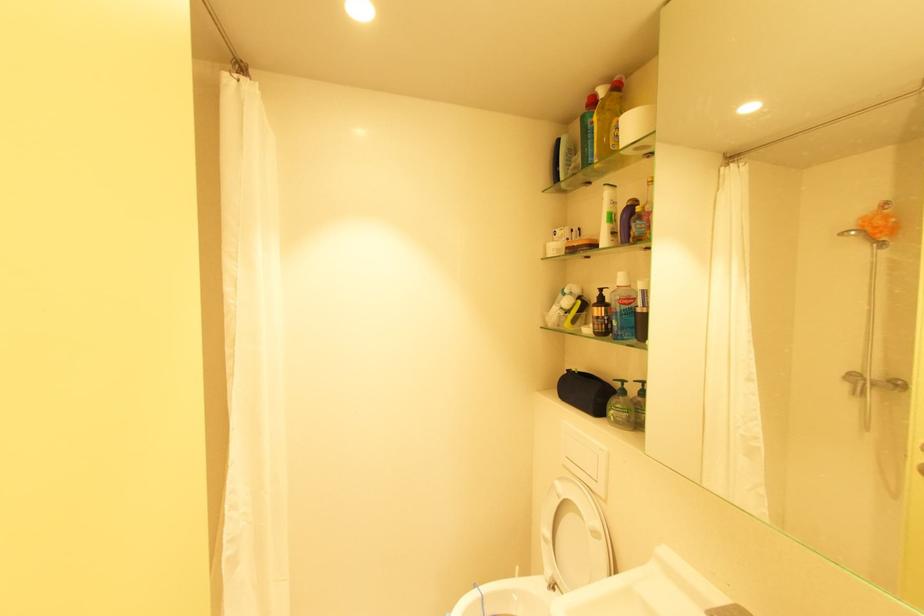
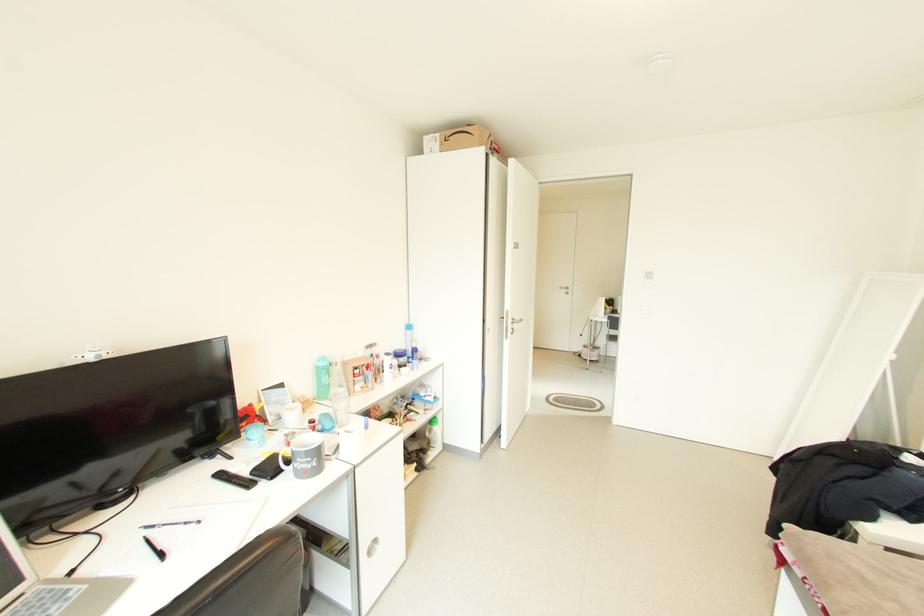
Question: I am providing you with two images of the same scene from different viewpoints. After the viewpoint changes to image2, which objects are now occluded?

Choices:
 (A) white feathered candle
 (B) blue-capped bottle
 (C) green water bottle
 (D) brown pump dispenser head

Answer: (D)